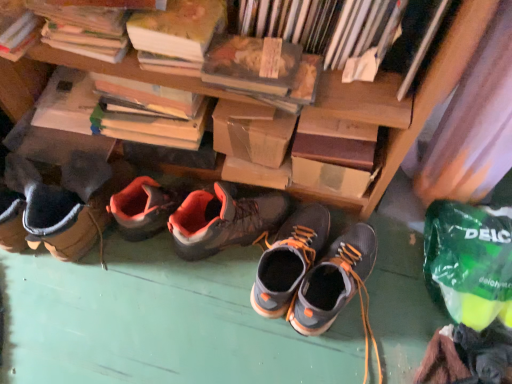
What is the approximate width of hardcover book at upper left, the third book when ordered from right to left?

hardcover book at upper left, the third book when ordered from right to left, is 5.46 inches wide.

This screenshot has width=512, height=384. Describe the element at coordinates (338, 287) in the screenshot. I see `matte gray and orange hiking boots at center, acting as the 1th footwear starting from the right` at that location.

Describe the element at coordinates (289, 259) in the screenshot. I see `dark gray suede shoes at center, which appears as the second footwear when viewed from the right` at that location.

What is the approximate height of dark gray suede shoes at center, placed as the second footwear when sorted from left to right?

6.15 inches.

What do you see at coordinates (177, 35) in the screenshot?
I see `hardcover book at upper center` at bounding box center [177, 35].

The image size is (512, 384). What do you see at coordinates (326, 25) in the screenshot?
I see `brown cardboard box at upper center, placed as the second book when sorted from right to left` at bounding box center [326, 25].

The image size is (512, 384). Describe the element at coordinates (423, 47) in the screenshot. I see `hardcover book at upper right, which ranks as the fourth book in left-to-right order` at that location.

Where is `hardcover book at upper left, the third book when ordered from right to left`? hardcover book at upper left, the third book when ordered from right to left is located at coordinates (85, 30).

From a real-world perspective, is hardcover book at upper right, which ranks as the fourth book in left-to-right order, above or below orange suede hiking boots at center, positioned as the third footwear in right-to-left order?

hardcover book at upper right, which ranks as the fourth book in left-to-right order, is situated higher than orange suede hiking boots at center, positioned as the third footwear in right-to-left order, in the real world.

Which object is more forward, hardcover book at upper right, which ranks as the fourth book in left-to-right order, or orange suede hiking boots at center, which ranks as the 1th footwear in left-to-right order?

hardcover book at upper right, which ranks as the fourth book in left-to-right order, is more forward.

Where is `the 1st book above the orange suede hiking boots at center, which ranks as the 1th footwear in left-to-right order (from the image's perspective)`? The image size is (512, 384). the 1st book above the orange suede hiking boots at center, which ranks as the 1th footwear in left-to-right order (from the image's perspective) is located at coordinates (423, 47).

Considering the positions of point (289, 278) and point (180, 219), is point (289, 278) closer or farther from the camera than point (180, 219)?

Point (289, 278) appears to be farther away from the viewer than point (180, 219).

Does dark gray suede shoes at center, placed as the second footwear when sorted from left to right, have a greater width compared to orange suede hiking boots at center, positioned as the third footwear in right-to-left order?

No.

Is the depth of dark gray suede shoes at center, which appears as the second footwear when viewed from the right, greater than that of orange suede hiking boots at center, positioned as the third footwear in right-to-left order?

No.

Consider the image. Considering the sizes of dark gray suede shoes at center, placed as the second footwear when sorted from left to right, and orange suede hiking boots at center, which ranks as the 1th footwear in left-to-right order, in the image, is dark gray suede shoes at center, placed as the second footwear when sorted from left to right, bigger or smaller than orange suede hiking boots at center, which ranks as the 1th footwear in left-to-right order,?

dark gray suede shoes at center, placed as the second footwear when sorted from left to right, is smaller than orange suede hiking boots at center, which ranks as the 1th footwear in left-to-right order.

In the scene shown: Is matte gray and orange hiking boots at center, acting as the 1th footwear starting from the right, spatially inside hardcover book at upper right, arranged as the first book when viewed from the right, or outside of it?

matte gray and orange hiking boots at center, acting as the 1th footwear starting from the right, lies outside hardcover book at upper right, arranged as the first book when viewed from the right.

At what (x,y) coordinates should I click in order to perform the action: click on the 3rd footwear below the hardcover book at upper right, which ranks as the fourth book in left-to-right order (from a real-world perspective). Please return your answer as a coordinate pair (x, y). Image resolution: width=512 pixels, height=384 pixels. Looking at the image, I should click on (338, 287).

Which is behind, point (365, 298) or point (406, 84)?

Point (365, 298)

Based on the photo, could you tell me if matte gray and orange hiking boots at center, the 3th footwear when ordered from left to right, is turned towards hardcover book at upper right, which ranks as the fourth book in left-to-right order?

No, matte gray and orange hiking boots at center, the 3th footwear when ordered from left to right, does not turn towards hardcover book at upper right, which ranks as the fourth book in left-to-right order.

Is orange suede hiking boots at center, positioned as the third footwear in right-to-left order, next to hardcover book at upper right, which ranks as the fourth book in left-to-right order, and touching it?

No, orange suede hiking boots at center, positioned as the third footwear in right-to-left order, is not beside hardcover book at upper right, which ranks as the fourth book in left-to-right order.

Is orange suede hiking boots at center, positioned as the third footwear in right-to-left order, turned away from hardcover book at upper right, arranged as the first book when viewed from the right?

orange suede hiking boots at center, positioned as the third footwear in right-to-left order, is not turned away from hardcover book at upper right, arranged as the first book when viewed from the right.

What's the angular difference between orange suede hiking boots at center, which ranks as the 1th footwear in left-to-right order, and hardcover book at upper right, which ranks as the fourth book in left-to-right order,'s facing directions?

orange suede hiking boots at center, which ranks as the 1th footwear in left-to-right order, and hardcover book at upper right, which ranks as the fourth book in left-to-right order, are facing 120 degrees away from each other.

Is orange suede hiking boots at center, which ranks as the 1th footwear in left-to-right order, inside the boundaries of hardcover book at upper right, arranged as the first book when viewed from the right, or outside?

orange suede hiking boots at center, which ranks as the 1th footwear in left-to-right order, is outside hardcover book at upper right, arranged as the first book when viewed from the right.

Which of these two, hardcover book at upper center or matte gray and orange hiking boots at center, the 3th footwear when ordered from left to right, is smaller?

hardcover book at upper center.

Locate an element on the screen. The image size is (512, 384). paperback book above the matte gray and orange hiking boots at center, the 3th footwear when ordered from left to right (from the image's perspective) is located at coordinates (177, 35).

Is point (170, 71) less distant than point (351, 234)?

Yes, it is.

In terms of height, does dark gray suede shoes at center, which appears as the second footwear when viewed from the right, look taller or shorter compared to hardcover book at upper left, which appears as the second book when viewed from the left?

Considering their sizes, dark gray suede shoes at center, which appears as the second footwear when viewed from the right, has more height than hardcover book at upper left, which appears as the second book when viewed from the left.

Are dark gray suede shoes at center, which appears as the second footwear when viewed from the right, and hardcover book at upper left, the third book when ordered from right to left, located far from each other?

No, dark gray suede shoes at center, which appears as the second footwear when viewed from the right, is not far from hardcover book at upper left, the third book when ordered from right to left.

Is point (277, 307) closer or farther from the camera than point (65, 45)?

Point (277, 307) appears to be farther away from the viewer than point (65, 45).

Does dark gray suede shoes at center, which appears as the second footwear when viewed from the right, appear on the right side of hardcover book at upper left, the third book when ordered from right to left?

Indeed, dark gray suede shoes at center, which appears as the second footwear when viewed from the right, is positioned on the right side of hardcover book at upper left, the third book when ordered from right to left.

Is hardcover book at upper left, the third book when ordered from right to left, aimed at hardcover book at upper left, which is counted as the 4th book, starting from the right?

No, hardcover book at upper left, the third book when ordered from right to left, does not turn towards hardcover book at upper left, which is counted as the 4th book, starting from the right.

Can you confirm if hardcover book at upper left, which appears as the second book when viewed from the left, is bigger than hardcover book at upper left, which is counted as the first book, starting from the left?

Yes, hardcover book at upper left, which appears as the second book when viewed from the left, is bigger than hardcover book at upper left, which is counted as the first book, starting from the left.

From the image's perspective, does hardcover book at upper left, which appears as the second book when viewed from the left, appear lower than hardcover book at upper left, which is counted as the first book, starting from the left?

No, from the image's perspective, hardcover book at upper left, which appears as the second book when viewed from the left, is not below hardcover book at upper left, which is counted as the first book, starting from the left.

Considering the sizes of objects hardcover book at upper left, the third book when ordered from right to left, and hardcover book at upper left, which is counted as the first book, starting from the left, in the image provided, who is shorter, hardcover book at upper left, the third book when ordered from right to left, or hardcover book at upper left, which is counted as the first book, starting from the left,?

With less height is hardcover book at upper left, which is counted as the first book, starting from the left.

From the image's perspective, starting from the orange suede hiking boots at center, positioned as the third footwear in right-to-left order, which book is the 1st one above? Please provide its 2D coordinates.

[(423, 47)]

Find the location of a particular element. This screenshot has width=512, height=384. footwear that appears behind the dark gray suede shoes at center, placed as the second footwear when sorted from left to right is located at coordinates (223, 220).

Looking at the image, which one is located closer to orange suede hiking boots at center, positioned as the third footwear in right-to-left order, hardcover book at upper left, which is counted as the first book, starting from the left, or brown cardboard box at upper center, the third book from the left?

brown cardboard box at upper center, the third book from the left.

Estimate the real-world distances between objects in this image. Which object is closer to brown cardboard box at upper center, placed as the second book when sorted from right to left, matte gray and orange hiking boots at center, acting as the 1th footwear starting from the right, or orange suede hiking boots at center, positioned as the third footwear in right-to-left order?

orange suede hiking boots at center, positioned as the third footwear in right-to-left order, lies closer to brown cardboard box at upper center, placed as the second book when sorted from right to left, than the other object.

When comparing their distances from matte gray and orange hiking boots at center, acting as the 1th footwear starting from the right, does hardcover book at upper left, which appears as the second book when viewed from the left, or brown cardboard box at upper center, placed as the second book when sorted from right to left, seem closer?

The object closer to matte gray and orange hiking boots at center, acting as the 1th footwear starting from the right, is brown cardboard box at upper center, placed as the second book when sorted from right to left.

Looking at the image, which one is located closer to matte gray and orange hiking boots at center, acting as the 1th footwear starting from the right, dark gray suede shoes at center, which appears as the second footwear when viewed from the right, or brown cardboard box at upper center, placed as the second book when sorted from right to left?

dark gray suede shoes at center, which appears as the second footwear when viewed from the right.

Looking at the image, which one is located further to hardcover book at upper right, which ranks as the fourth book in left-to-right order, matte gray and orange hiking boots at center, the 3th footwear when ordered from left to right, or hardcover book at upper left, which is counted as the 4th book, starting from the right?

hardcover book at upper left, which is counted as the 4th book, starting from the right, lies further to hardcover book at upper right, which ranks as the fourth book in left-to-right order, than the other object.

Which object lies further to the anchor point matte gray and orange hiking boots at center, the 3th footwear when ordered from left to right, brown cardboard box at upper center, placed as the second book when sorted from right to left, or hardcover book at upper left, the third book when ordered from right to left?

hardcover book at upper left, the third book when ordered from right to left, is further to matte gray and orange hiking boots at center, the 3th footwear when ordered from left to right.

From the picture: Looking at the image, which one is located further to hardcover book at upper right, which ranks as the fourth book in left-to-right order, hardcover book at upper center or orange suede hiking boots at center, which ranks as the 1th footwear in left-to-right order?

orange suede hiking boots at center, which ranks as the 1th footwear in left-to-right order, lies further to hardcover book at upper right, which ranks as the fourth book in left-to-right order, than the other object.

Based on their spatial positions, is dark gray suede shoes at center, placed as the second footwear when sorted from left to right, or hardcover book at upper left, which is counted as the first book, starting from the left, further from matte gray and orange hiking boots at center, the 3th footwear when ordered from left to right?

Based on the image, hardcover book at upper left, which is counted as the first book, starting from the left, appears to be further to matte gray and orange hiking boots at center, the 3th footwear when ordered from left to right.

I want to click on book between hardcover book at upper left, the third book when ordered from right to left, and hardcover book at upper right, which ranks as the fourth book in left-to-right order, in the horizontal direction, so click(326, 25).

The image size is (512, 384). Find the location of `paperback book between hardcover book at upper left, which is counted as the first book, starting from the left, and dark gray suede shoes at center, placed as the second footwear when sorted from left to right, from left to right`. paperback book between hardcover book at upper left, which is counted as the first book, starting from the left, and dark gray suede shoes at center, placed as the second footwear when sorted from left to right, from left to right is located at coordinates (177, 35).

Image resolution: width=512 pixels, height=384 pixels. Identify the location of footwear located between hardcover book at upper left, which is counted as the first book, starting from the left, and dark gray suede shoes at center, placed as the second footwear when sorted from left to right, in the left-right direction. (223, 220).

In order to click on paperback book situated between hardcover book at upper left, the third book when ordered from right to left, and hardcover book at upper right, which ranks as the fourth book in left-to-right order, from left to right in this screenshot , I will do click(x=177, y=35).